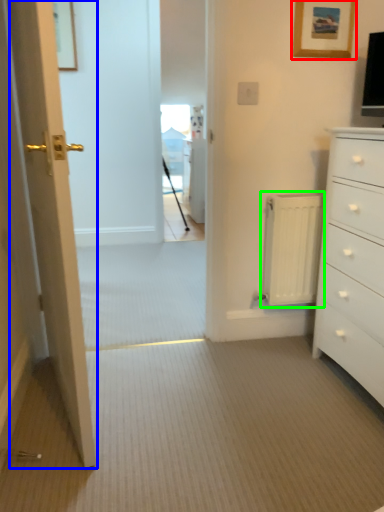
Question: Considering the real-world distances, which object is closest to picture frame (highlighted by a red box)? door (highlighted by a blue box) or radiator (highlighted by a green box).

Choices:
 (A) door
 (B) radiator

Answer: (B)